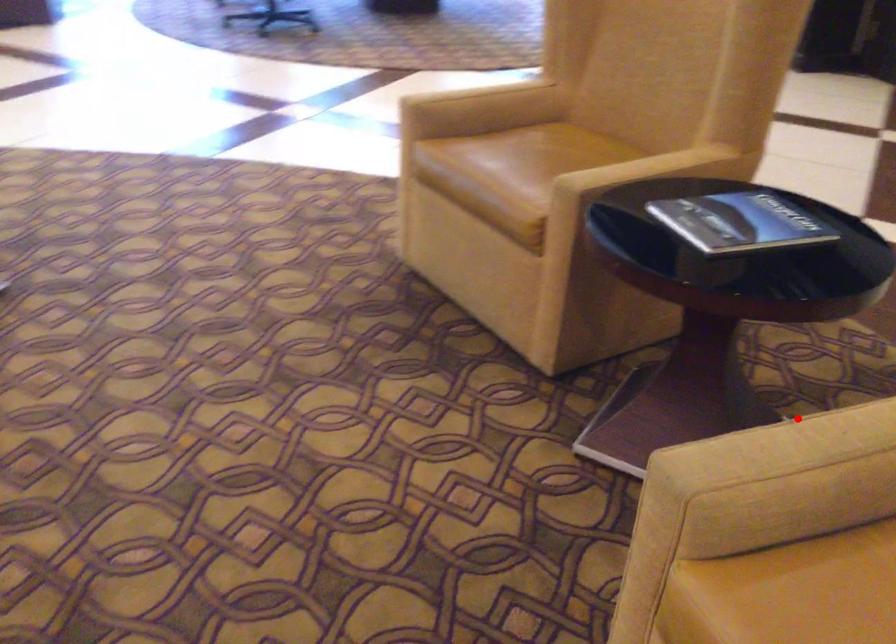
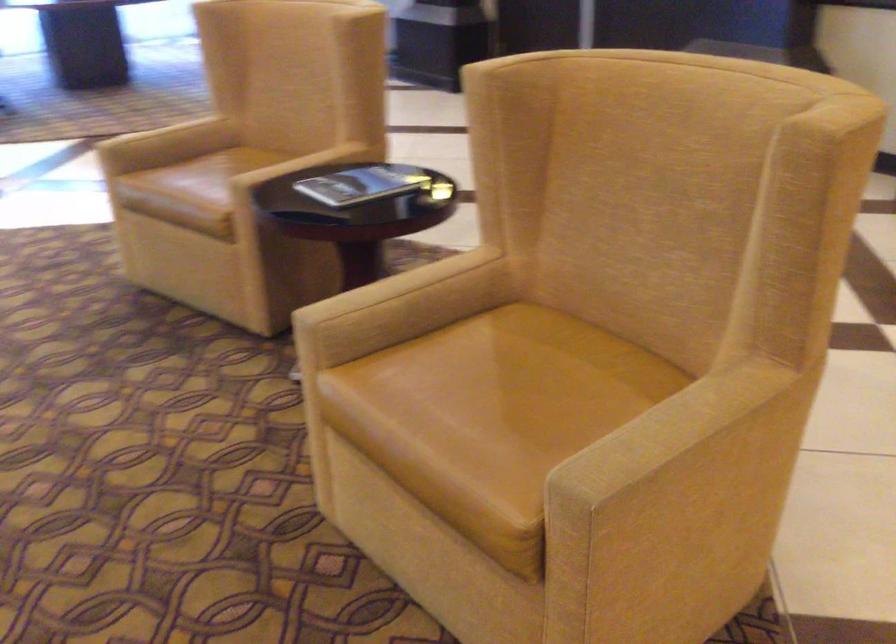
The point at the highlighted location is marked in the first image. Where is the corresponding point in the second image?

(394, 286)